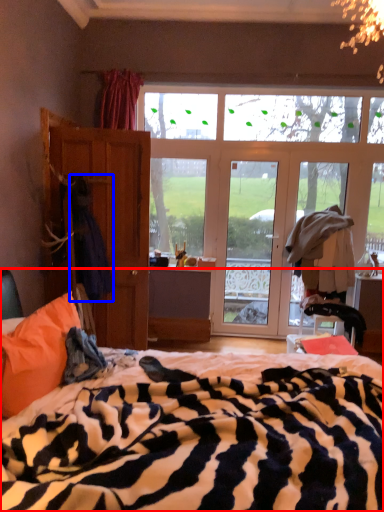
Question: Which object appears closest to the camera in this image, bed (highlighted by a red box) or laundry (highlighted by a blue box)?

Choices:
 (A) bed
 (B) laundry

Answer: (A)